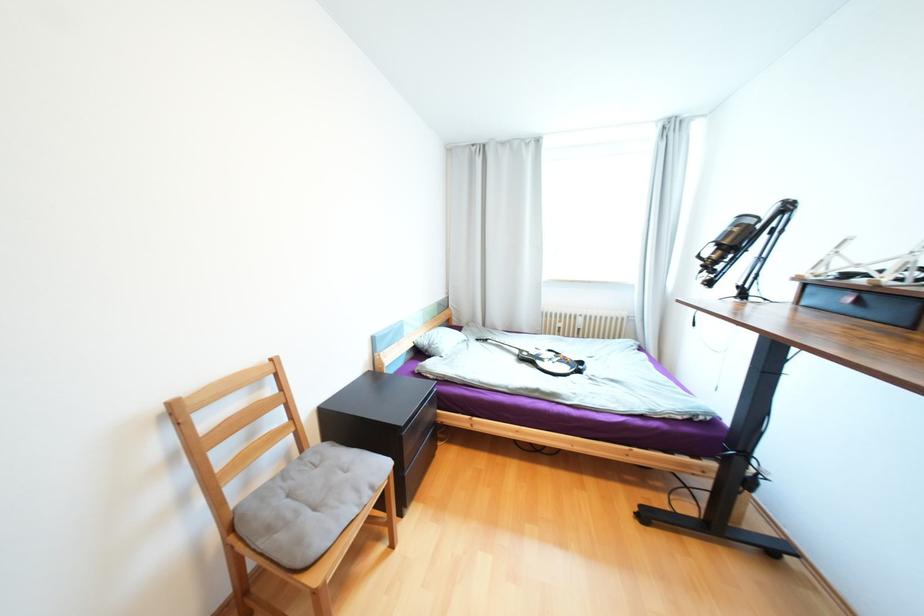
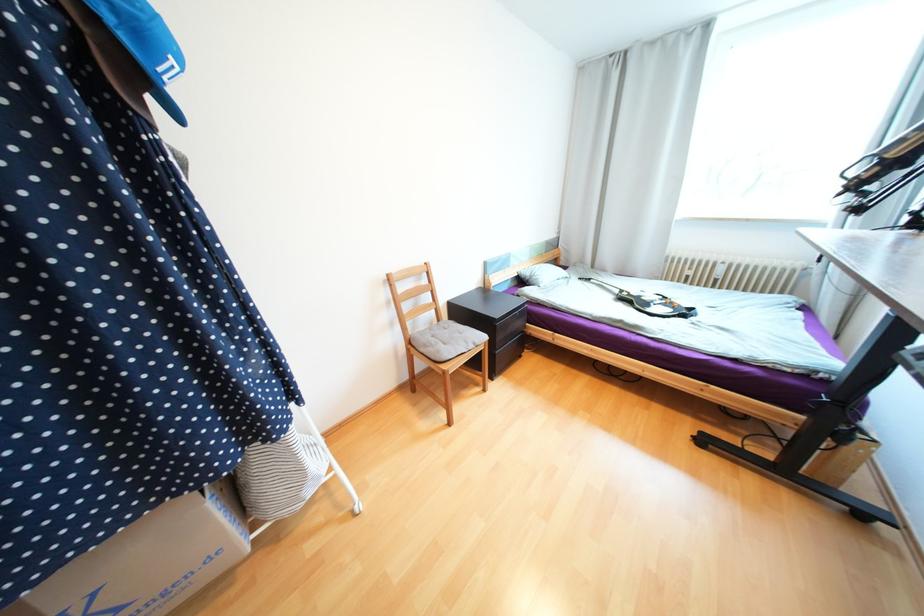
In the second image, find the point that corresponds to pixel 363 492 in the first image.

(472, 342)